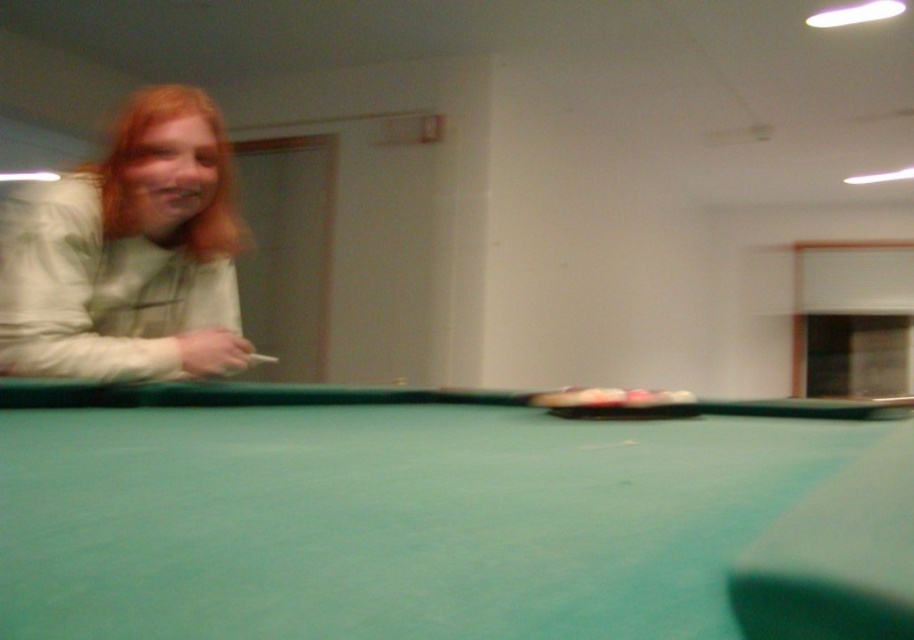
How far apart are blonde hair at left and blonde hair at upper left?

blonde hair at left is 12.71 centimeters away from blonde hair at upper left.

I want to click on blonde hair at left, so click(130, 253).

The image size is (914, 640). What are the coordinates of `blonde hair at left` in the screenshot? It's located at (130, 253).

Image resolution: width=914 pixels, height=640 pixels. Describe the element at coordinates (444, 516) in the screenshot. I see `green felt billiard table at center` at that location.

Does green felt billiard table at center come in front of blonde hair at upper left?

That is True.

Is point (190, 387) farther from viewer compared to point (230, 188)?

No, (190, 387) is closer to viewer.

Where is `green felt billiard table at center`? This screenshot has height=640, width=914. green felt billiard table at center is located at coordinates (x=444, y=516).

Which is below, green felt billiard table at center or blonde hair at left?

green felt billiard table at center is lower down.

Is green felt billiard table at center wider than blonde hair at left?

Yes, green felt billiard table at center is wider than blonde hair at left.

At what (x,y) coordinates should I click in order to perform the action: click on green felt billiard table at center. Please return your answer as a coordinate pair (x, y). The height and width of the screenshot is (640, 914). Looking at the image, I should click on (444, 516).